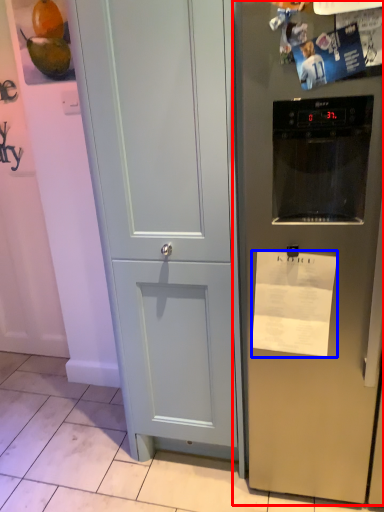
Question: Which point is further to the camera, refrigerator (highlighted by a red box) or paper (highlighted by a blue box)?

Choices:
 (A) refrigerator
 (B) paper

Answer: (B)